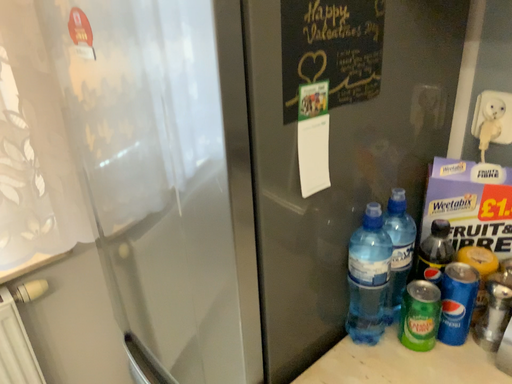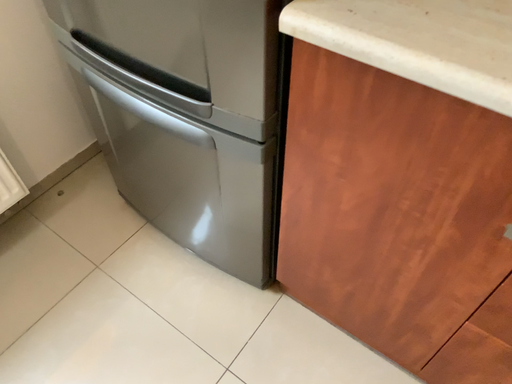
Question: Which way did the camera rotate in the video?

Choices:
 (A) rotated right
 (B) rotated left

Answer: (A)